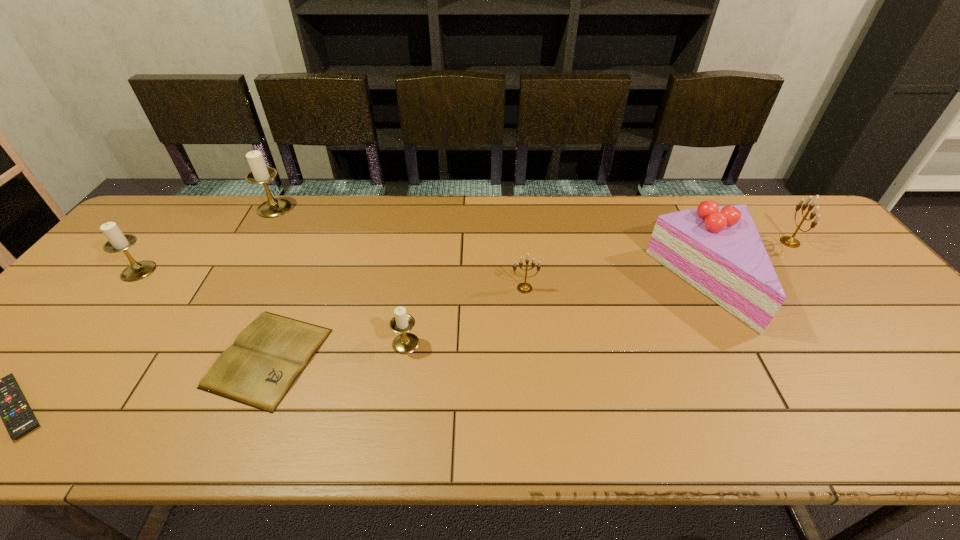
This screenshot has height=540, width=960. I want to click on the rightmost white candle holder, so click(x=405, y=343).

This screenshot has width=960, height=540. I want to click on the fifth object from left to right, so click(x=405, y=343).

Locate an element on the screen. This screenshot has width=960, height=540. book is located at coordinates (258, 370).

What are the coordinates of `the fourth object from left to right` in the screenshot? It's located at (258, 370).

This screenshot has height=540, width=960. In order to click on vacant space located 0.320m on the right of the tallest candle holder in this screenshot , I will do `click(388, 208)`.

In order to click on free location located on the left of the purple cake in this screenshot , I will do `click(525, 284)`.

Identify the location of vacant space situated on the front of the right gold candelabrum. (876, 350).

Identify the location of free point located 0.110m on the back of the second biggest white candle holder. (167, 237).

Where is `vacant space located on the front of the nearer gold candelabrum`? This screenshot has width=960, height=540. vacant space located on the front of the nearer gold candelabrum is located at coordinates (531, 349).

Find the location of a particular element. The width and height of the screenshot is (960, 540). free space located on the right of the fifth object from left to right is located at coordinates (524, 343).